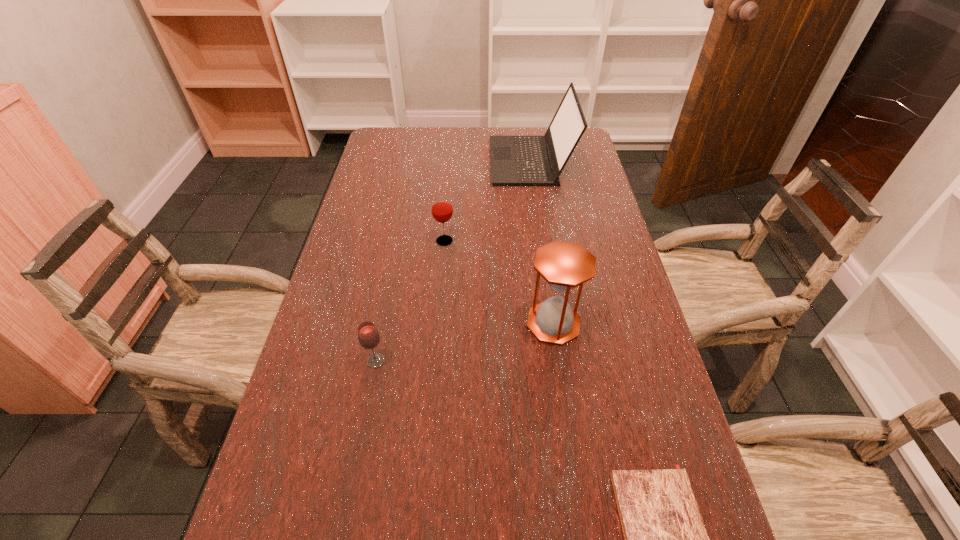
You are a GUI agent. You are given a task and a screenshot of the screen. Output one action in this format:
    pyautogui.click(x=<x>, y=<y>)
    Task: Click on the vacant space located on the back of the taller glass drink container
    Image resolution: width=960 pixels, height=540 pixels.
    Given the screenshot: What is the action you would take?
    pyautogui.click(x=447, y=202)

Find the location of a particular element. vacant space located on the back of the nearer glass drink container is located at coordinates (384, 319).

I want to click on object that is at the far edge, so click(x=515, y=160).

The image size is (960, 540). Find the location of `object present at the left edge`. object present at the left edge is located at coordinates (369, 338).

In order to click on laptop that is at the right edge in this screenshot , I will do `click(515, 160)`.

Identify the location of hourglass located in the right edge section of the desktop. (564, 265).

Identify the location of object located at the far right corner. (515, 160).

Find the location of a particular element. The width and height of the screenshot is (960, 540). free space at the far edge is located at coordinates (444, 140).

The height and width of the screenshot is (540, 960). In the image, there is a desktop. Identify the location of vacant space at the left edge. (390, 190).

Where is `vacant region at the right edge of the desktop`? vacant region at the right edge of the desktop is located at coordinates (584, 352).